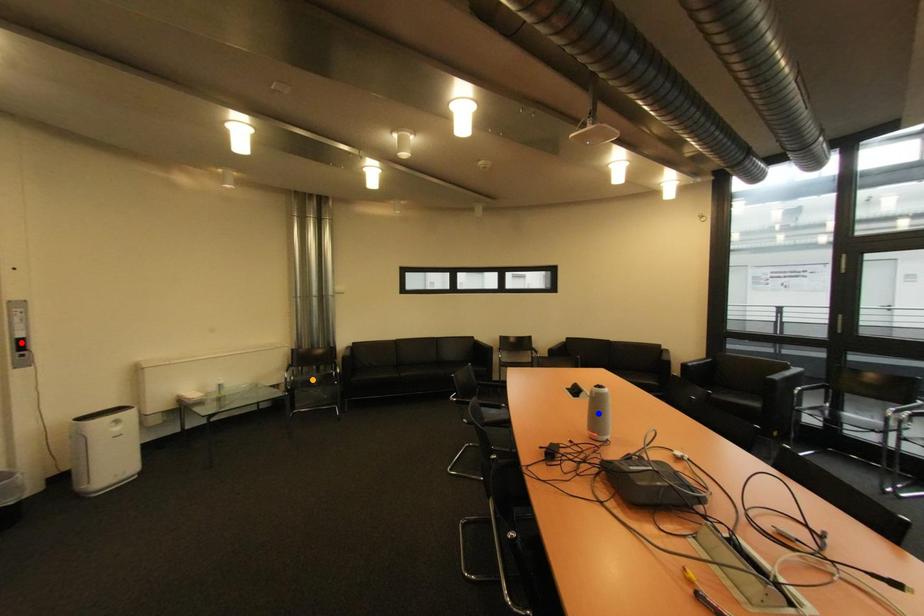
Order these from nearest to farthest:
red point
orange point
blue point

red point
blue point
orange point